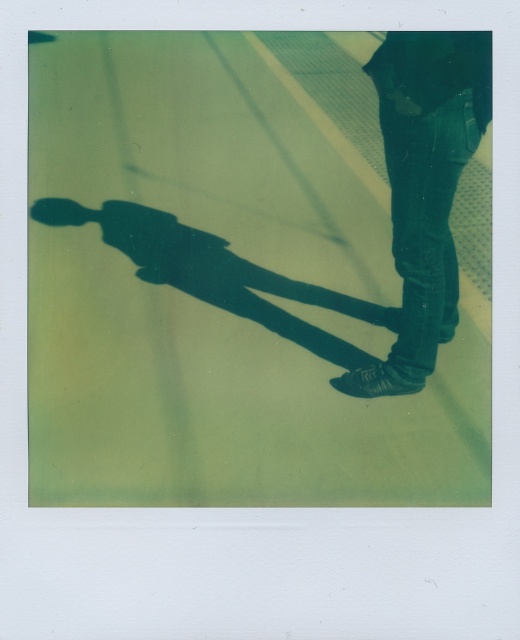
You are a photographer analyzing this Polaroid image. You notice the green polished concrete at center and the jeans at right. Which object appears taller in the image?

The green polished concrete at center is taller than jeans at right.

You are a photographer trying to capture the shadow of the person in the image. Since the green polished concrete at center and jeans at right are in the frame, which object is covering the other one?

The green polished concrete at center is positioned over jeans at right, so it is covering the jeans at right.

You are a photographer analyzing the Polaroid image. You notice the jeans at right and the green polished concrete at center. Which object is closer to the camera?

The green polished concrete at center is closer to the camera than the jeans at right because the jeans at right is behind it.